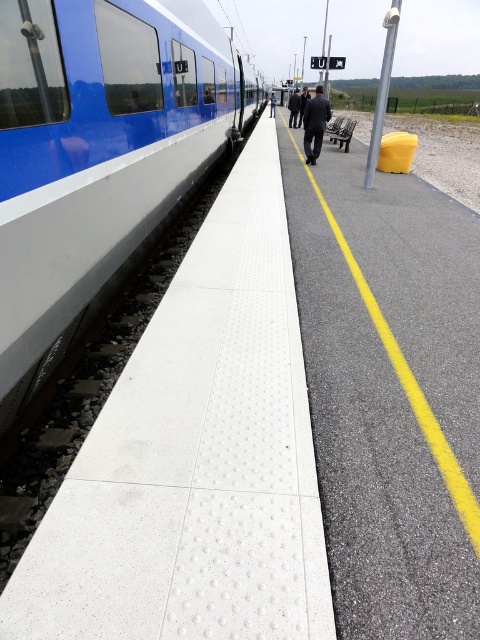
Question: Is dark gray suit at center wider than black fabric coat at center?

Choices:
 (A) yes
 (B) no

Answer: (B)

Question: Which of these objects is positioned closest to the dark gray suit at center?

Choices:
 (A) blue glossy train at left
 (B) black fabric coat at center

Answer: (A)

Question: Which of the following is the farthest from the observer?

Choices:
 (A) (289, 109)
 (B) (319, 88)
 (C) (173, 195)

Answer: (B)

Question: Is blue glossy train at left to the right of dark gray suit at center from the viewer's perspective?

Choices:
 (A) no
 (B) yes

Answer: (A)

Question: Does blue glossy train at left appear on the left side of black fabric coat at center?

Choices:
 (A) yes
 (B) no

Answer: (A)

Question: Considering the real-world distances, which object is closest to the dark gray suit at center?

Choices:
 (A) blue glossy train at left
 (B) black fabric coat at center

Answer: (A)